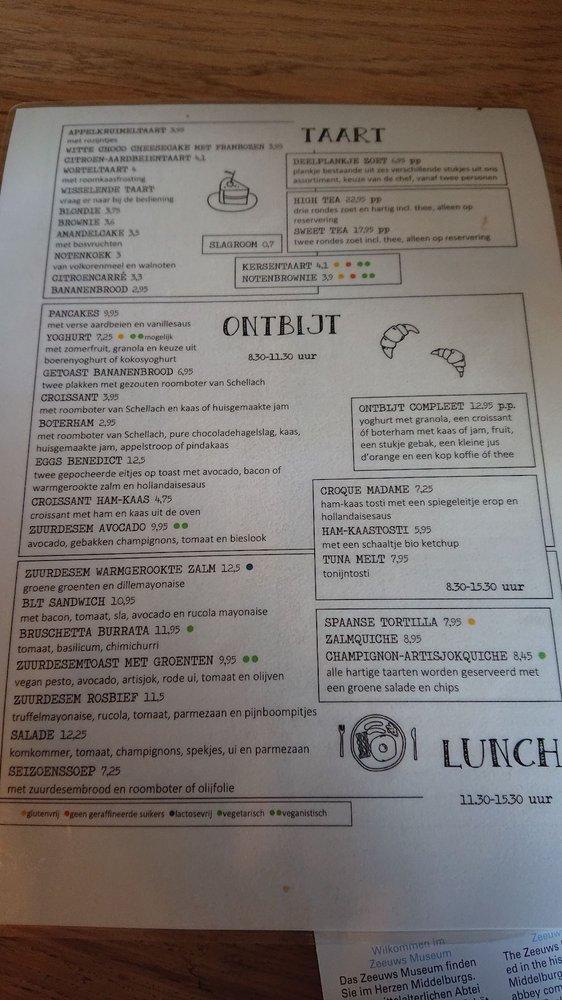
Image resolution: width=562 pixels, height=1000 pixels. Identify the location of table. (117, 966).